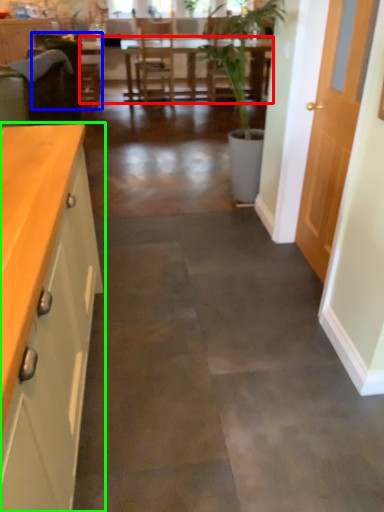
Question: Estimate the real-world distances between objects in this image. Which object is farther from table (highlighted by a red box), armchair (highlighted by a blue box) or cabinetry (highlighted by a green box)?

Choices:
 (A) armchair
 (B) cabinetry

Answer: (B)